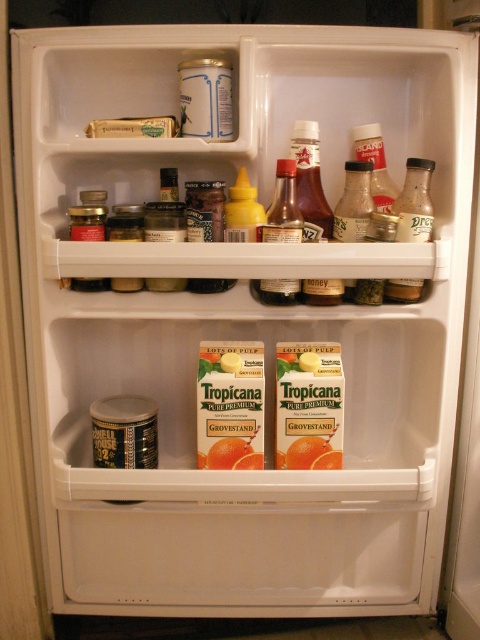
Question: Which point appears closest to the camera in this image?

Choices:
 (A) (243, 236)
 (B) (264, 282)
 (C) (399, 195)

Answer: (A)

Question: Can you confirm if translucent plastic bottle at upper right is positioned below orange matte carton at upper center?

Choices:
 (A) yes
 (B) no

Answer: (A)

Question: Can you confirm if translucent plastic bottle at center is positioned above orange matte carton at upper center?

Choices:
 (A) yes
 (B) no

Answer: (B)

Question: Estimate the real-world distances between objects in this image. Which object is closer to the translucent plastic bottle at upper right?

Choices:
 (A) orange matte carton at upper center
 (B) translucent plastic bottle at center

Answer: (B)

Question: Estimate the real-world distances between objects in this image. Which object is farther from the translucent plastic bottle at center?

Choices:
 (A) translucent plastic bottle at upper right
 (B) orange matte carton at upper center

Answer: (A)

Question: Is translucent plastic bottle at upper right to the right of orange matte carton at upper center from the viewer's perspective?

Choices:
 (A) no
 (B) yes

Answer: (B)